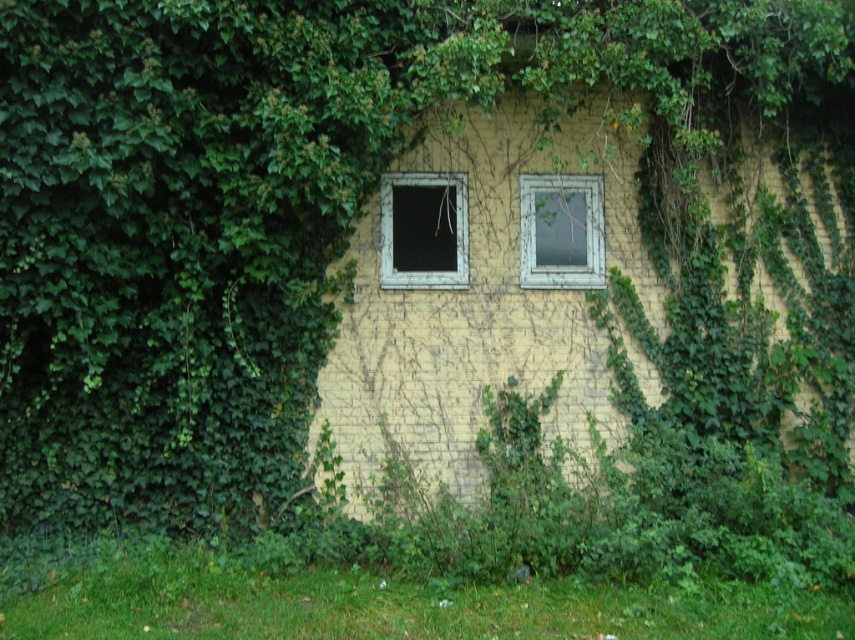
Question: Does matte gray window at center have a lesser width compared to white wooden window at center?

Choices:
 (A) no
 (B) yes

Answer: (A)

Question: Is matte gray window at center wider than white wooden window at center?

Choices:
 (A) no
 (B) yes

Answer: (B)

Question: From the image, what is the correct spatial relationship of matte gray window at center in relation to white wooden window at center?

Choices:
 (A) left
 (B) right

Answer: (A)

Question: Which point is farther to the camera?

Choices:
 (A) (401, 260)
 (B) (541, 228)

Answer: (B)

Question: Which of the following is the closest to the observer?

Choices:
 (A) matte gray window at center
 (B) white wooden window at center

Answer: (A)

Question: Which object appears closest to the camera in this image?

Choices:
 (A) matte gray window at center
 (B) white wooden window at center

Answer: (A)